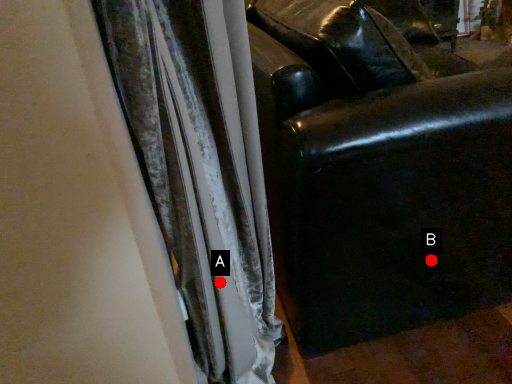
Question: Two points are circled on the image, labeled by A and B beside each circle. Which point is closer to the camera?

Choices:
 (A) A is closer
 (B) B is closer

Answer: (A)